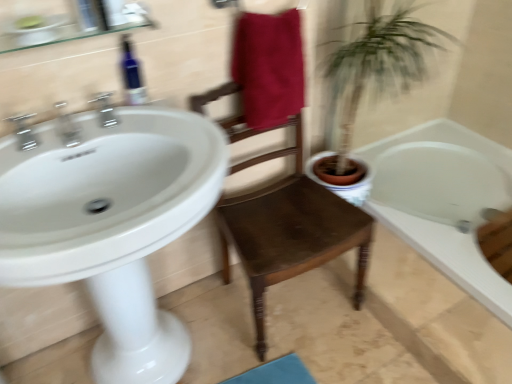
Question: Considering the relative positions of brown wooden chair at center and maroon fabric towel at center in the image provided, is brown wooden chair at center to the right of maroon fabric towel at center from the viewer's perspective?

Choices:
 (A) yes
 (B) no

Answer: (A)

Question: Is brown wooden chair at center thinner than maroon fabric towel at center?

Choices:
 (A) no
 (B) yes

Answer: (A)

Question: Does brown wooden chair at center have a greater width compared to maroon fabric towel at center?

Choices:
 (A) yes
 (B) no

Answer: (A)

Question: From a real-world perspective, is brown wooden chair at center positioned over maroon fabric towel at center based on gravity?

Choices:
 (A) yes
 (B) no

Answer: (B)

Question: From the image's perspective, would you say brown wooden chair at center is shown under maroon fabric towel at center?

Choices:
 (A) no
 (B) yes

Answer: (B)

Question: Is brown wooden chair at center bigger than maroon fabric towel at center?

Choices:
 (A) no
 (B) yes

Answer: (B)

Question: Is blue glass bottle at upper left beside white glossy bathtub at lower right?

Choices:
 (A) yes
 (B) no

Answer: (B)

Question: Is blue glass bottle at upper left oriented away from white glossy bathtub at lower right?

Choices:
 (A) no
 (B) yes

Answer: (A)

Question: Considering the relative sizes of blue glass bottle at upper left and white glossy bathtub at lower right in the image provided, is blue glass bottle at upper left wider than white glossy bathtub at lower right?

Choices:
 (A) yes
 (B) no

Answer: (B)

Question: From the image's perspective, would you say blue glass bottle at upper left is shown under white glossy bathtub at lower right?

Choices:
 (A) no
 (B) yes

Answer: (A)

Question: Is blue glass bottle at upper left at the left side of white glossy bathtub at lower right?

Choices:
 (A) yes
 (B) no

Answer: (A)

Question: Considering the relative sizes of blue glass bottle at upper left and white glossy bathtub at lower right in the image provided, is blue glass bottle at upper left shorter than white glossy bathtub at lower right?

Choices:
 (A) yes
 (B) no

Answer: (B)

Question: Are white glossy sink at left and blue glass bottle at upper left located far from each other?

Choices:
 (A) no
 (B) yes

Answer: (A)